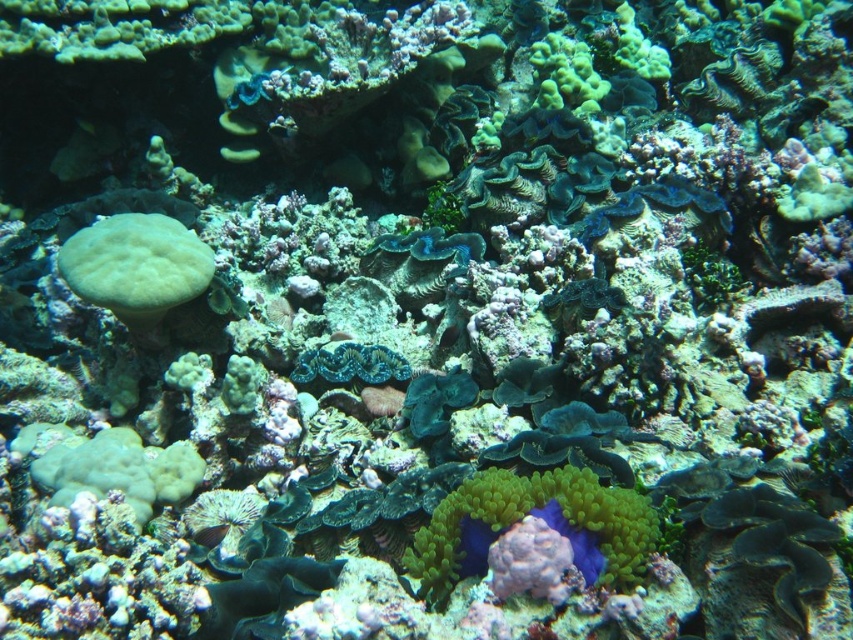
Question: Which point is farther to the camera?

Choices:
 (A) green matte coral at left
 (B) blue-green textured coral at center
 (C) green soft coral at center

Answer: (B)

Question: Among these objects, which one is farthest from the camera?

Choices:
 (A) blue-green textured coral at center
 (B) green soft coral at center

Answer: (A)

Question: In this image, where is green soft coral at center located relative to green matte coral at left?

Choices:
 (A) below
 (B) above

Answer: (A)

Question: Does green soft coral at center appear under green matte coral at left?

Choices:
 (A) yes
 (B) no

Answer: (A)

Question: Which point appears closest to the camera in this image?

Choices:
 (A) (373, 344)
 (B) (511, 513)

Answer: (B)

Question: Where is green matte coral at left located in relation to blue-green textured coral at center in the image?

Choices:
 (A) below
 (B) above

Answer: (B)